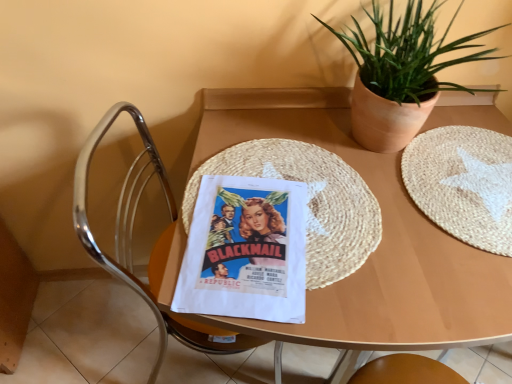
In order to click on free space above white woven placemat at center right (from a real-world perspective) in this screenshot , I will do `click(471, 182)`.